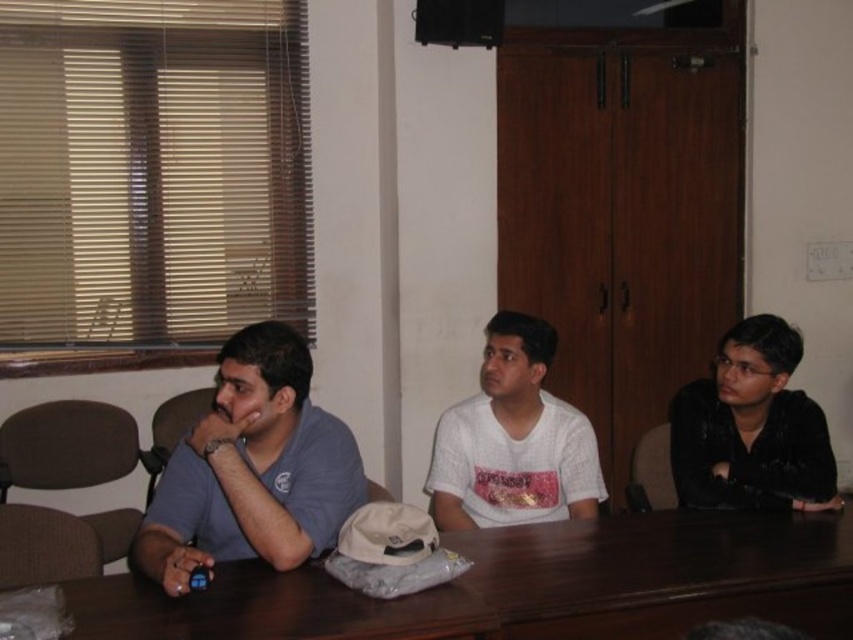
You are a person sitting at the brown wooden table at center. You want to pass a pen to the person wearing the white matte shirt at center. Can you reach them without getting up from your seat?

The brown wooden table at center is 17.51 inches away from white matte shirt at center. Since the distance is relatively short, you can likely reach the person wearing the white matte shirt at center across the table without needing to stand up.

You are sitting at the brown wooden table at center and want to hand a document to the person wearing the white matte shirt at center. Can you directly hand it to them without getting up?

The brown wooden table at center is in front of the white matte shirt at center, so you can directly hand the document to them without needing to get up.

What object is located at the coordinate point [521,586] in the image?

The point [521,586] corresponds to the brown wooden table at center.